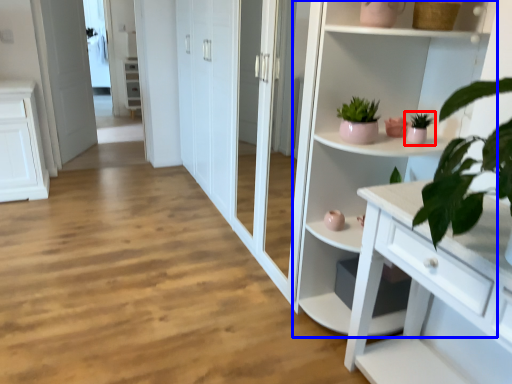
Question: Which of the following is the closest to the observer, houseplant (highlighted by a red box) or cupboard (highlighted by a blue box)?

Choices:
 (A) houseplant
 (B) cupboard

Answer: (B)